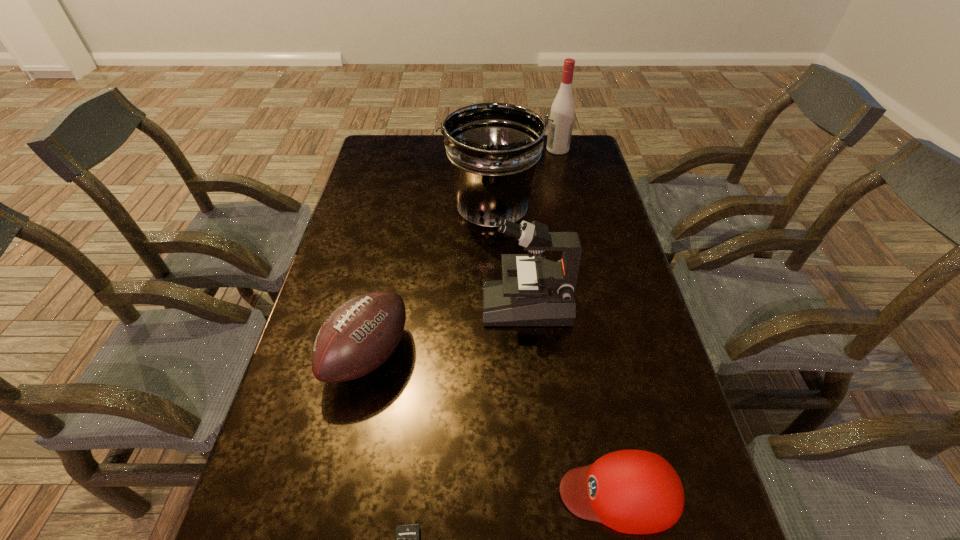
You are a GUI agent. You are given a task and a screenshot of the screen. Output one action in this format:
    pyautogui.click(x=<x>, y=<y>)
    Task: Click on the vacant space located 0.290m through the eyepieces of the microscope
    This screenshot has width=960, height=540.
    Given the screenshot: What is the action you would take?
    click(x=373, y=305)

This screenshot has width=960, height=540. Find the location of `vacant area situated through the eyepieces of the microscope`. vacant area situated through the eyepieces of the microscope is located at coordinates (426, 305).

Locate an element on the screen. free space located 0.190m through the eyepieces of the microscope is located at coordinates (411, 305).

Locate an element on the screen. This screenshot has width=960, height=540. free location located 0.120m on the back of the fourth tallest object is located at coordinates (383, 284).

Locate an element on the screen. free space located 0.330m on the front-facing side of the baseball cap is located at coordinates (386, 493).

Find the location of a particular element. This screenshot has height=540, width=960. vacant region located 0.130m on the front-facing side of the baseball cap is located at coordinates (491, 493).

At what (x,y) coordinates should I click in order to perform the action: click on vacant position located 0.210m on the front-facing side of the baseball cap. Please return your answer as a coordinate pair (x, y). This screenshot has height=540, width=960. Looking at the image, I should click on (449, 493).

I want to click on object that is at the far edge, so click(562, 112).

At what (x,y) coordinates should I click in order to perform the action: click on object that is at the left edge. Please return your answer as a coordinate pair (x, y). The image size is (960, 540). Looking at the image, I should click on (361, 334).

Identify the location of alcohol at the right edge. The height and width of the screenshot is (540, 960). (562, 112).